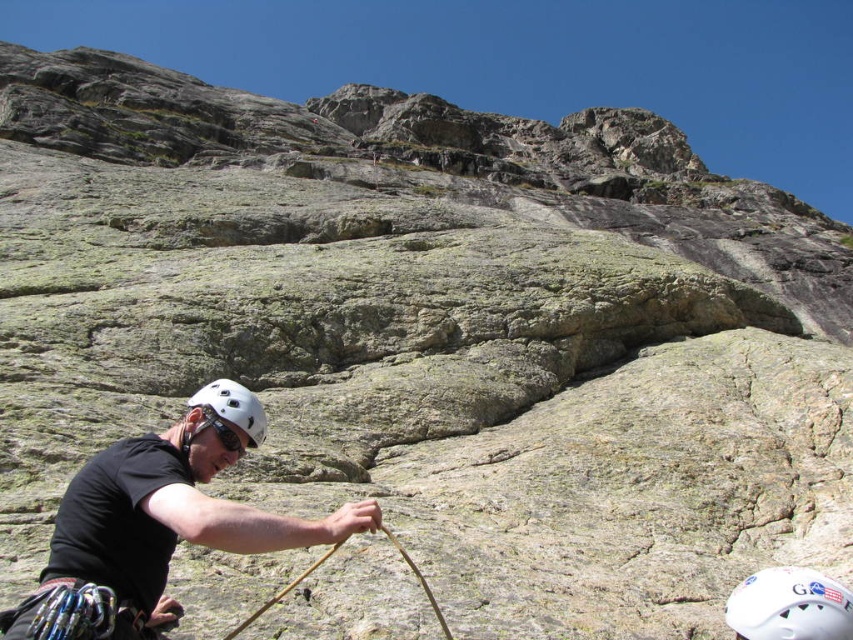
Question: Can you confirm if white matte helmet at lower right is smaller than white matte helmet at lower left?

Choices:
 (A) yes
 (B) no

Answer: (A)

Question: Does black matte helmet at lower left appear over white matte helmet at lower left?

Choices:
 (A) yes
 (B) no

Answer: (B)

Question: Is black matte helmet at lower left wider than white matte helmet at lower left?

Choices:
 (A) no
 (B) yes

Answer: (B)

Question: Which point appears farthest from the camera in this image?

Choices:
 (A) pos(218,408)
 (B) pos(119,570)

Answer: (A)

Question: Considering the real-world distances, which object is farthest from the white matte helmet at lower right?

Choices:
 (A) black matte helmet at lower left
 (B) white matte helmet at lower left

Answer: (B)

Question: Which object appears closest to the camera in this image?

Choices:
 (A) black matte helmet at lower left
 (B) white matte helmet at lower right
 (C) white matte helmet at lower left

Answer: (A)